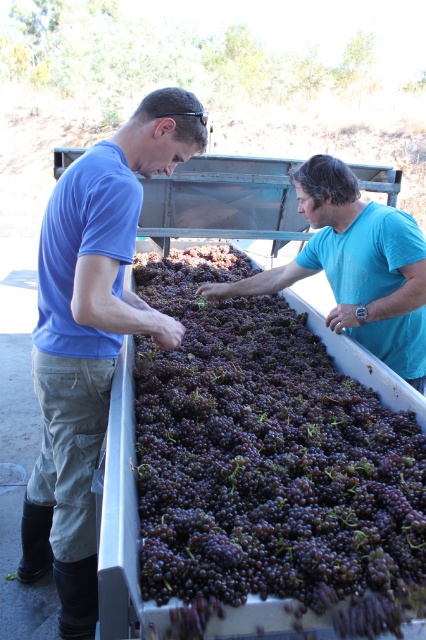
Which is in front, point (265, 324) or point (417, 253)?

Point (417, 253) is in front.

Find the location of `purple matte grapes at center`. purple matte grapes at center is located at coordinates (267, 460).

Who is higher up, blue cotton shirt at left or blue cotton shirt at center?

Positioned higher is blue cotton shirt at center.

Does blue cotton shirt at left have a lesser width compared to blue cotton shirt at center?

Yes.

Measure the distance between blue cotton shirt at left and camera.

Result: blue cotton shirt at left and camera are 4.76 feet apart from each other.

Where is `blue cotton shirt at left`? The width and height of the screenshot is (426, 640). blue cotton shirt at left is located at coordinates (92, 336).

Can you confirm if purple matte grapes at center is bigger than blue cotton shirt at left?

No, purple matte grapes at center is not bigger than blue cotton shirt at left.

Can you confirm if purple matte grapes at center is positioned below blue cotton shirt at left?

Incorrect, purple matte grapes at center is not positioned below blue cotton shirt at left.

Does point (301, 440) come closer to viewer compared to point (49, 426)?

Yes, it is in front of point (49, 426).

In order to click on purple matte grapes at center in this screenshot , I will do `click(267, 460)`.